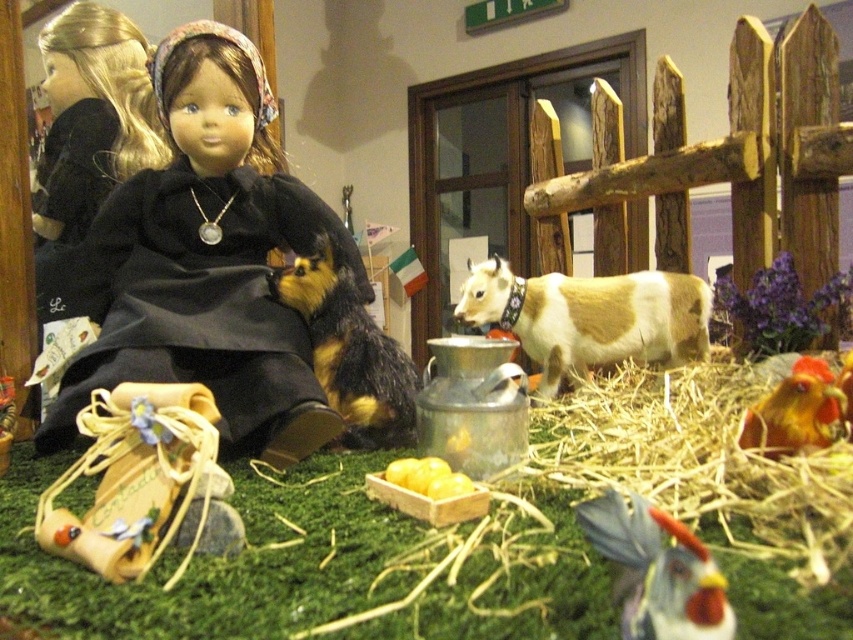
Question: Can you confirm if matte yellow fabric boot at lower left is positioned to the right of smooth brown rooster at lower right?

Choices:
 (A) yes
 (B) no

Answer: (B)

Question: Which point is farther to the camera?

Choices:
 (A) light brown and white plastic cow at center
 (B) smooth brown rooster at lower right

Answer: (A)

Question: Can you confirm if matte yellow fabric boot at lower left is positioned below light brown and white plastic cow at center?

Choices:
 (A) no
 (B) yes

Answer: (B)

Question: Which of the following is the farthest from the observer?

Choices:
 (A) (161, 260)
 (B) (775, 420)
 (C) (318, 241)

Answer: (C)

Question: Which of the following is the farthest from the observer?

Choices:
 (A) [349, 236]
 (B) [622, 618]
 (C) [590, 365]
 (D) [805, 365]

Answer: (C)

Question: Is matte black dress at center closer to camera compared to straw hay at lower right?

Choices:
 (A) no
 (B) yes

Answer: (A)